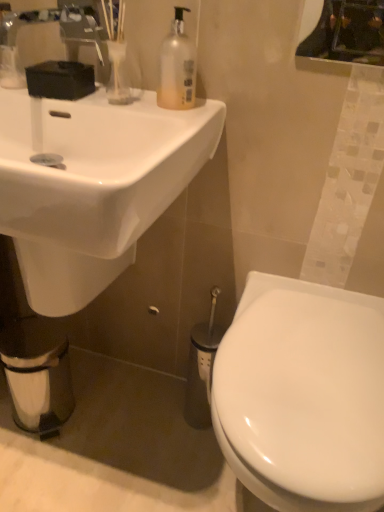
Question: Based on their sizes in the image, would you say white matte toilet paper at lower left is bigger or smaller than translucent plastic soap dispenser at upper center?

Choices:
 (A) small
 (B) big

Answer: (B)

Question: Considering the positions of point (46, 399) and point (182, 101), is point (46, 399) closer or farther from the camera than point (182, 101)?

Choices:
 (A) closer
 (B) farther

Answer: (B)

Question: Which is farther from the metallic reflective mirror at upper right?

Choices:
 (A) white glossy toilet at lower right
 (B) translucent plastic soap dispenser at upper center
 (C) white glossy sink at upper left
 (D) white matte toilet paper at lower left

Answer: (D)

Question: Considering the real-world distances, which object is closest to the metallic reflective mirror at upper right?

Choices:
 (A) white matte toilet paper at lower left
 (B) white glossy toilet at lower right
 (C) translucent plastic soap dispenser at upper center
 (D) white glossy sink at upper left

Answer: (C)